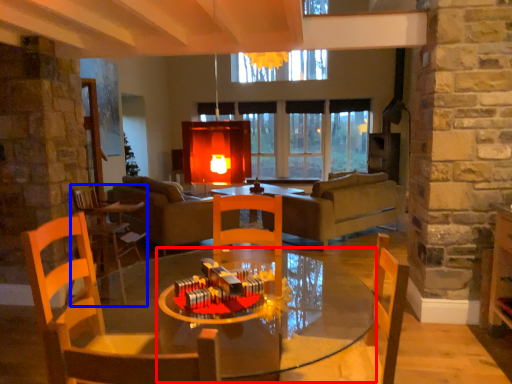
Question: Which object is closer to the camera taking this photo, round table (highlighted by a red box) or chair (highlighted by a blue box)?

Choices:
 (A) round table
 (B) chair

Answer: (A)